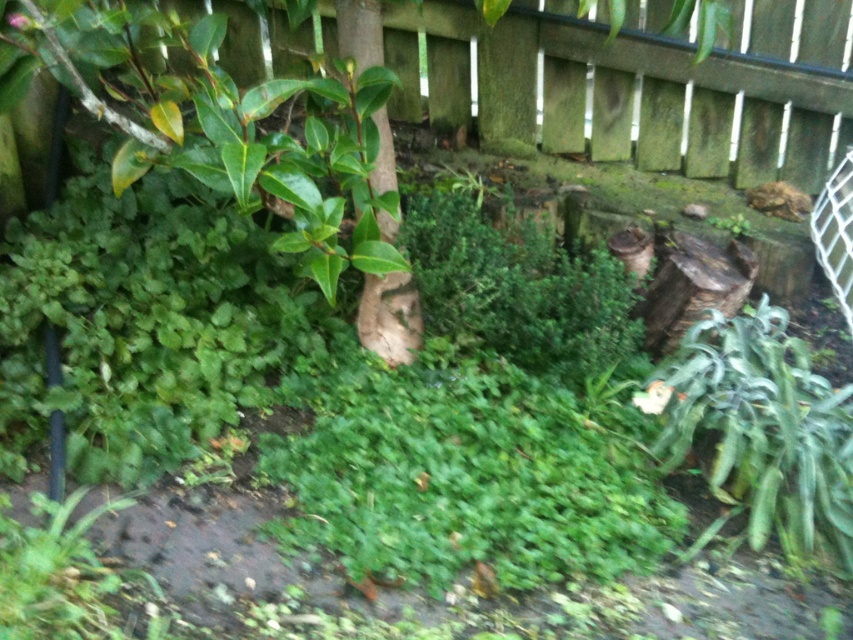
Is green leafy grass at center bigger than green leafy bush at center?

Indeed, green leafy grass at center has a larger size compared to green leafy bush at center.

Identify the location of green leafy grass at center. The image size is (853, 640). (463, 474).

This screenshot has height=640, width=853. In order to click on green leafy grass at center in this screenshot , I will do `click(463, 474)`.

Is green leafy bush at center wider than brown rough tree trunk at center?

Correct, the width of green leafy bush at center exceeds that of brown rough tree trunk at center.

Does green leafy bush at center have a smaller size compared to brown rough tree trunk at center?

Incorrect, green leafy bush at center is not smaller in size than brown rough tree trunk at center.

Which is in front, point (467, 305) or point (397, 337)?

Point (467, 305) is more forward.

Locate an element on the screen. This screenshot has height=640, width=853. green leafy bush at center is located at coordinates (515, 282).

Who is positioned more to the right, green leafy grass at center or brown rough tree trunk at center?

From the viewer's perspective, green leafy grass at center appears more on the right side.

From the picture: Can you confirm if green leafy grass at center is wider than brown rough tree trunk at center?

Indeed, green leafy grass at center has a greater width compared to brown rough tree trunk at center.

The image size is (853, 640). Find the location of `green leafy grass at center`. green leafy grass at center is located at coordinates (463, 474).